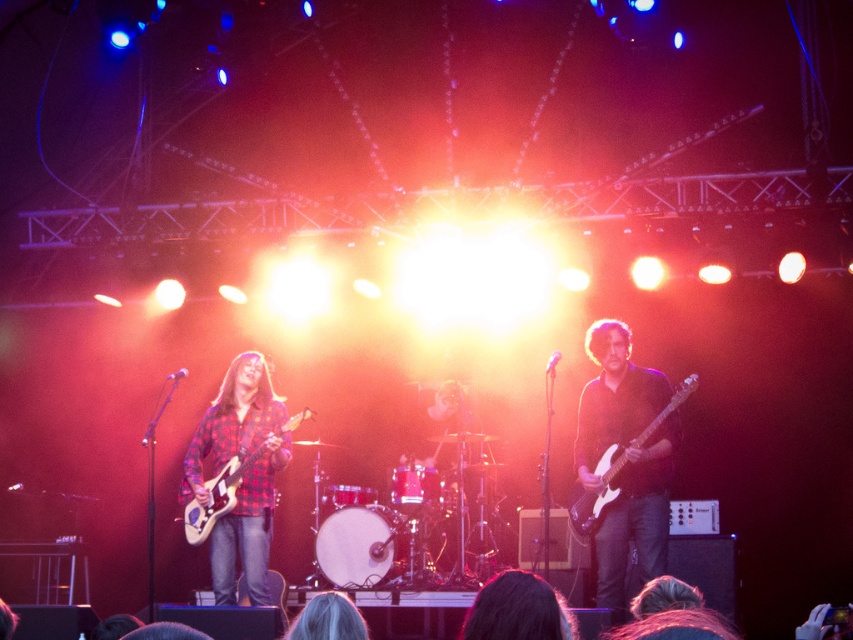
Question: Is white glossy electric guitar at right bigger than gray hair at center?

Choices:
 (A) yes
 (B) no

Answer: (A)

Question: Which is nearer to the plaid fabric guitar at left?

Choices:
 (A) white glossy electric guitar at right
 (B) gray hair at center
 (C) dark brown hair at lower center

Answer: (A)

Question: Which point is closer to the camera?

Choices:
 (A) gray hair at center
 (B) white glossy electric guitar at right
 (C) white drumhead at center
 (D) plaid fabric guitar at left

Answer: (A)

Question: Can you confirm if white drumhead at center is thinner than plaid fabric guitar at left?

Choices:
 (A) no
 (B) yes

Answer: (B)

Question: Which point is closer to the camera?

Choices:
 (A) (552, 602)
 (B) (212, 522)
 (C) (589, 522)
 (D) (328, 600)

Answer: (A)

Question: Is white drumhead at center below gray hair at center?

Choices:
 (A) no
 (B) yes

Answer: (B)